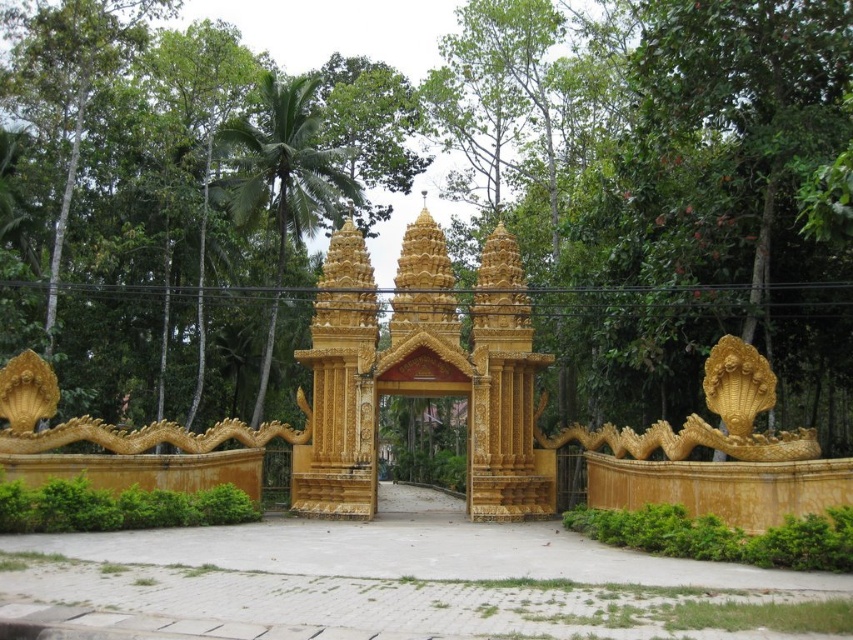
Question: Among these objects, which one is nearest to the camera?

Choices:
 (A) gold ornate gate at center
 (B) green leafy tree at upper left
 (C) green leafy tree at center
 (D) golden polished gate at center

Answer: (C)

Question: Can you confirm if golden polished gate at center is thinner than green leafy tree at upper left?

Choices:
 (A) yes
 (B) no

Answer: (B)

Question: Considering the relative positions of green leafy tree at upper left and gold ornate gate at center in the image provided, where is green leafy tree at upper left located with respect to gold ornate gate at center?

Choices:
 (A) left
 (B) right

Answer: (A)

Question: Which object is the farthest from the green leafy tree at upper left?

Choices:
 (A) golden polished gate at center
 (B) green leafy tree at center
 (C) gold ornate gate at center

Answer: (C)

Question: Which point is closer to the camera?

Choices:
 (A) green leafy tree at center
 (B) green leafy tree at upper left
 (C) gold ornate gate at center
 (D) golden polished gate at center

Answer: (A)

Question: Is green leafy tree at center to the left of gold ornate gate at center from the viewer's perspective?

Choices:
 (A) no
 (B) yes

Answer: (A)